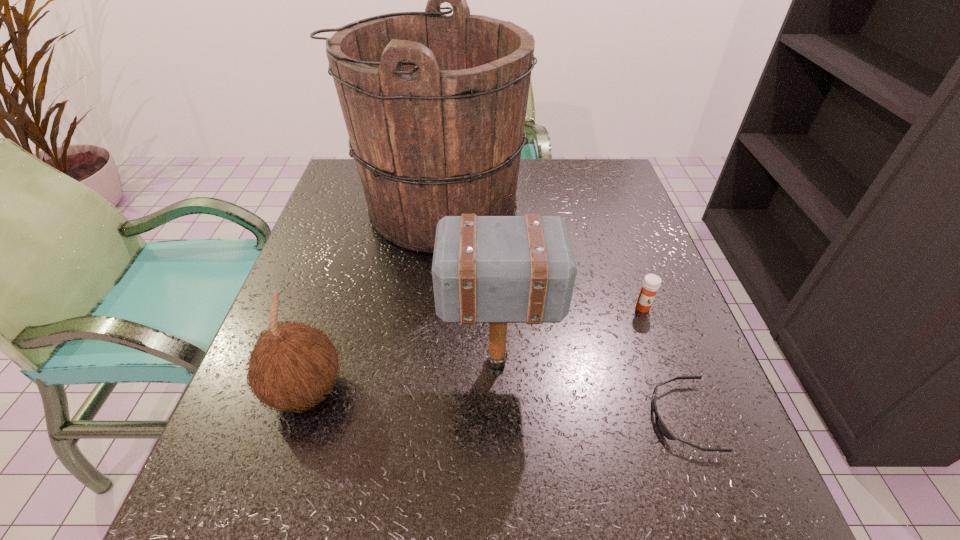
At what (x,y) coordinates should I click in order to perform the action: click on vacant region located 0.100m on the striking surface of the fourth shortest object. Please return your answer as a coordinate pair (x, y). Image resolution: width=960 pixels, height=540 pixels. Looking at the image, I should click on (390, 362).

At what (x,y) coordinates should I click in order to perform the action: click on vacant position located on the surface of the coconut. Please return your answer as a coordinate pair (x, y). The image size is (960, 540). Looking at the image, I should click on (377, 390).

In order to click on free space located 0.360m on the label side of the medicine in this screenshot , I will do (x=713, y=508).

Where is `free point located on the front-facing side of the shortest object`? free point located on the front-facing side of the shortest object is located at coordinates (492, 417).

The image size is (960, 540). Identify the location of vacant position located 0.190m on the front-facing side of the shortest object. (536, 417).

This screenshot has height=540, width=960. Find the location of `vacant region located 0.350m on the front-facing side of the shortest object`. vacant region located 0.350m on the front-facing side of the shortest object is located at coordinates (437, 417).

You are a GUI agent. You are given a task and a screenshot of the screen. Output one action in this format:
    pyautogui.click(x=<x>, y=<y>)
    Task: Click on the object present at the far edge
    
    Given the screenshot: What is the action you would take?
    pyautogui.click(x=434, y=105)

Locate an element on the screen. The width and height of the screenshot is (960, 540). bucket present at the left edge is located at coordinates (434, 105).

Find the location of a particular element. The height and width of the screenshot is (540, 960). coconut that is at the left edge is located at coordinates (292, 365).

At what (x,y) coordinates should I click in order to perform the action: click on medicine at the right edge. Please return your answer as a coordinate pair (x, y). This screenshot has height=540, width=960. Looking at the image, I should click on (651, 283).